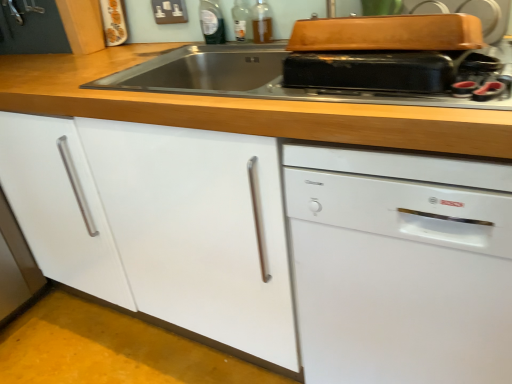
Question: From the image's perspective, is transparent plastic bottle at upper center, the first bottle when ordered from left to right, located above or below matte black toaster at upper center?

Choices:
 (A) above
 (B) below

Answer: (A)

Question: From their relative heights in the image, would you say transparent plastic bottle at upper center, the first bottle when ordered from left to right, is taller or shorter than matte black toaster at upper center?

Choices:
 (A) short
 (B) tall

Answer: (B)

Question: Which object is positioned closest to the white matte cabinet at center?

Choices:
 (A) translucent glass bottle at upper center, which is the 1th bottle in right-to-left order
 (B) transparent glass bottle at upper center, the 2th bottle in the right-to-left sequence
 (C) wooden at upper center
 (D) white glossy dishwasher at right
 (E) transparent plastic bottle at upper center, which is counted as the third bottle, starting from the right

Answer: (C)

Question: Which object is the farthest from the white matte cabinet at center?

Choices:
 (A) white plastic electric outlet at upper center
 (B) transparent glass bottle at upper center, the 2th bottle in the right-to-left sequence
 (C) matte black toaster at upper center
 (D) translucent glass bottle at upper center, acting as the 3th bottle starting from the left
 (E) white glossy dishwasher at right

Answer: (A)